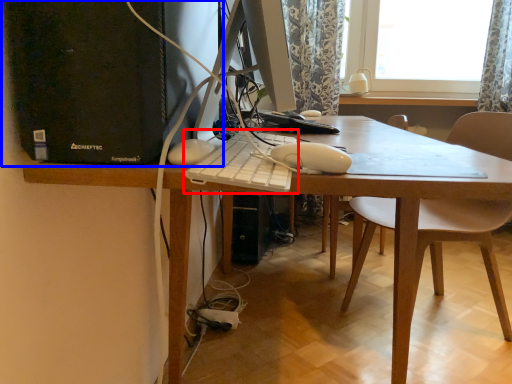
Question: Which point is closer to the camera, computer keyboard (highlighted by a red box) or computer tower (highlighted by a blue box)?

Choices:
 (A) computer keyboard
 (B) computer tower

Answer: (A)